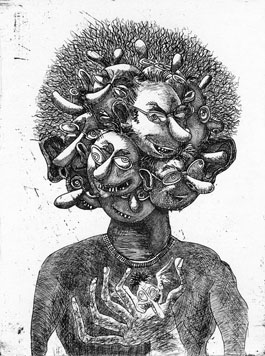
Where is `chest`? Image resolution: width=265 pixels, height=356 pixels. chest is located at coordinates (185, 304), (83, 295).